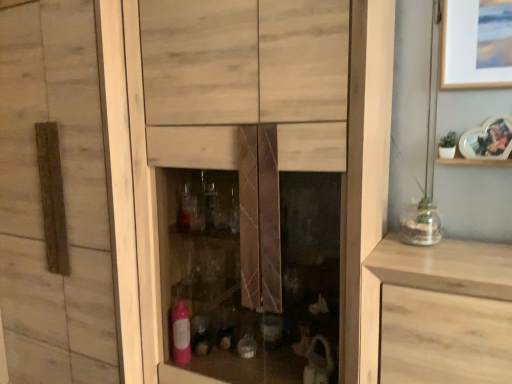
What is the approximate width of light wood drawer at right?

light wood drawer at right is 18.94 inches wide.

The image size is (512, 384). Find the location of `light wood drawer at right`. light wood drawer at right is located at coordinates pos(444,338).

At what (x,y) coordinates should I click in order to perform the action: click on wooden shelf at upper right. Please return your answer as a coordinate pair (x, y). Looking at the image, I should click on (474, 162).

The image size is (512, 384). Identify the location of heart-shaped photo frame at upper right. (488, 140).

The width and height of the screenshot is (512, 384). What are the coordinates of `light wood drawer at right` in the screenshot? It's located at (444, 338).

Is heart-shaped photo frame at upper right inside the boundaries of light wood drawer at right, or outside?

heart-shaped photo frame at upper right is spatially situated outside light wood drawer at right.

Is heart-shaped photo frame at upper right taller or shorter than light wood drawer at right?

Clearly, heart-shaped photo frame at upper right is shorter compared to light wood drawer at right.

Considering the sizes of objects heart-shaped photo frame at upper right and light wood drawer at right in the image provided, who is wider, heart-shaped photo frame at upper right or light wood drawer at right?

Wider between the two is light wood drawer at right.

From a real-world perspective, is heart-shaped photo frame at upper right physically above clear glass vase at right?

Yes, from a real-world perspective, heart-shaped photo frame at upper right is above clear glass vase at right.

Is heart-shaped photo frame at upper right to the left of clear glass vase at right from the viewer's perspective?

In fact, heart-shaped photo frame at upper right is to the right of clear glass vase at right.

Considering the points (482, 136) and (432, 221), which point is behind, point (482, 136) or point (432, 221)?

The point (432, 221) is farther.

Is wooden shelf at upper right looking in the opposite direction of light wood drawer at right?

wooden shelf at upper right is not turned away from light wood drawer at right.

Is the surface of wooden shelf at upper right in direct contact with light wood drawer at right?

wooden shelf at upper right and light wood drawer at right are not in contact.

From a real-world perspective, is wooden shelf at upper right located higher than light wood drawer at right?

Yes, from a real-world perspective, wooden shelf at upper right is over light wood drawer at right

Is light wood drawer at right spatially inside wooden shelf at upper right, or outside of it?

light wood drawer at right cannot be found inside wooden shelf at upper right.

From the image's perspective, is light wood drawer at right above or below wooden shelf at upper right?

Based on their image positions, light wood drawer at right is located beneath wooden shelf at upper right.

In the scene shown: How different are the orientations of light wood drawer at right and wooden shelf at upper right in degrees?

0.539 degrees.

Is light wood drawer at right smaller than wooden shelf at upper right?

No, light wood drawer at right is not smaller than wooden shelf at upper right.

From a real-world perspective, between clear glass vase at right and heart-shaped photo frame at upper right, who is vertically lower?

clear glass vase at right, from a real-world perspective.

Is clear glass vase at right positioned far away from heart-shaped photo frame at upper right?

Actually, clear glass vase at right and heart-shaped photo frame at upper right are a little close together.

How far apart are clear glass vase at right and heart-shaped photo frame at upper right?

The distance of clear glass vase at right from heart-shaped photo frame at upper right is 29.73 centimeters.

Is clear glass vase at right positioned before heart-shaped photo frame at upper right?

No, clear glass vase at right is further to the viewer.

From the image's perspective, is light wood drawer at right over clear glass vase at right?

No, from the image's perspective, light wood drawer at right is not over clear glass vase at right.

Considering the sizes of objects light wood drawer at right and clear glass vase at right in the image provided, who is smaller, light wood drawer at right or clear glass vase at right?

A: Smaller between the two is clear glass vase at right.

Is light wood drawer at right positioned in front of clear glass vase at right?

Yes, light wood drawer at right is in front of clear glass vase at right.

From their relative heights in the image, would you say light wood drawer at right is taller or shorter than clear glass vase at right?

Considering their sizes, light wood drawer at right has more height than clear glass vase at right.

Is point (489, 347) closer to viewer compared to point (471, 139)?

Yes, point (489, 347) is in front of point (471, 139).

Is light wood drawer at right wider than heart-shaped photo frame at upper right?

Yes, light wood drawer at right is wider than heart-shaped photo frame at upper right.

Considering the positions of objects light wood drawer at right and heart-shaped photo frame at upper right in the image provided, who is behind, light wood drawer at right or heart-shaped photo frame at upper right?

heart-shaped photo frame at upper right is further from the camera.

Identify the location of picture frame above the light wood drawer at right (from a real-world perspective). The width and height of the screenshot is (512, 384). (488, 140).

Find the location of a particular element. This screenshot has height=384, width=512. glass jar below the heart-shaped photo frame at upper right (from a real-world perspective) is located at coordinates (420, 224).

When comparing their distances from wooden shelf at upper right, does light wood drawer at right or clear glass vase at right seem further?

light wood drawer at right.

Based on their spatial positions, is clear glass vase at right or light wood drawer at right closer to heart-shaped photo frame at upper right?

clear glass vase at right is positioned closer to the anchor heart-shaped photo frame at upper right.

Estimate the real-world distances between objects in this image. Which object is closer to heart-shaped photo frame at upper right, wooden shelf at upper right or clear glass vase at right?

wooden shelf at upper right is closer to heart-shaped photo frame at upper right.

When comparing their distances from light wood drawer at right, does clear glass vase at right or wooden shelf at upper right seem further?

The object further to light wood drawer at right is wooden shelf at upper right.

Which object lies further to the anchor point wooden shelf at upper right, clear glass vase at right or light wood drawer at right?

Based on the image, light wood drawer at right appears to be further to wooden shelf at upper right.

Considering their positions, is light wood drawer at right positioned further to clear glass vase at right than wooden shelf at upper right?

light wood drawer at right is further to clear glass vase at right.

Which object lies nearer to the anchor point light wood drawer at right, heart-shaped photo frame at upper right or wooden shelf at upper right?

wooden shelf at upper right lies closer to light wood drawer at right than the other object.

From the image, which object appears to be nearer to wooden shelf at upper right, clear glass vase at right or heart-shaped photo frame at upper right?

heart-shaped photo frame at upper right is positioned closer to the anchor wooden shelf at upper right.

At what (x,y) coordinates should I click in order to perform the action: click on shelf that lies between heart-shaped photo frame at upper right and light wood drawer at right from top to bottom. Please return your answer as a coordinate pair (x, y). Looking at the image, I should click on (474, 162).

Where is `glass jar between wooden shelf at upper right and light wood drawer at right in the up-down direction`? Image resolution: width=512 pixels, height=384 pixels. glass jar between wooden shelf at upper right and light wood drawer at right in the up-down direction is located at coordinates (420, 224).

Locate an element on the screen. glass jar that lies between heart-shaped photo frame at upper right and light wood drawer at right from top to bottom is located at coordinates (420, 224).

You are a GUI agent. You are given a task and a screenshot of the screen. Output one action in this format:
    pyautogui.click(x=<x>, y=<y>)
    Task: Click on the shelf between heart-shaped photo frame at upper right and clear glass vase at right in the up-down direction
    This screenshot has height=384, width=512.
    Given the screenshot: What is the action you would take?
    [474, 162]